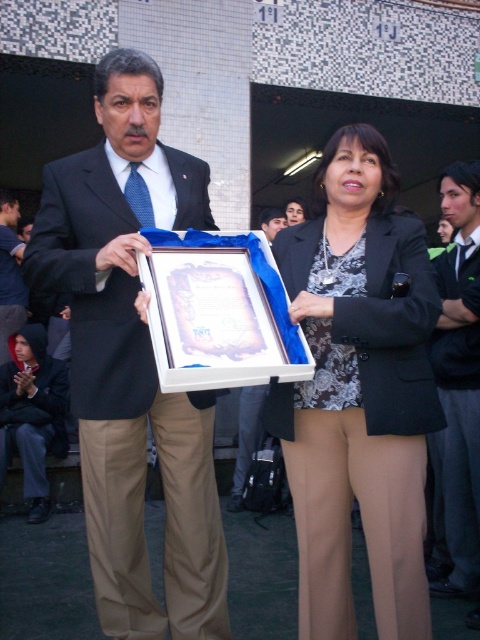
Question: Can you confirm if matte black suit at center is positioned below matte black jacket at center?

Choices:
 (A) no
 (B) yes

Answer: (B)

Question: Which point is farther to the camera?

Choices:
 (A) [x=439, y=433]
 (B) [x=303, y=490]

Answer: (A)

Question: Considering the real-world distances, which object is farthest from the dark green fabric business suit at right?

Choices:
 (A) matte black suit at left
 (B) matte black blazer at center
 (C) matte black suit at center

Answer: (A)

Question: Can you confirm if matte black suit at left is wider than matte black frame at center?

Choices:
 (A) yes
 (B) no

Answer: (A)

Question: Is matte black suit at center bigger than matte black frame at center?

Choices:
 (A) yes
 (B) no

Answer: (A)

Question: Estimate the real-world distances between objects in this image. Which object is closer to the matte black suit at center?

Choices:
 (A) matte black suit at left
 (B) matte black jacket at center
 (C) dark green fabric business suit at right

Answer: (C)